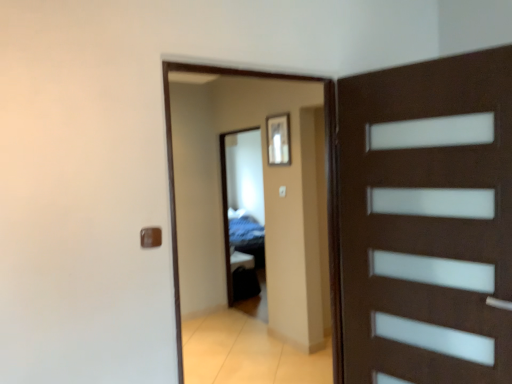
Question: From a real-world perspective, is transparent glass door at center located higher than brown matte door handle at lower left?

Choices:
 (A) no
 (B) yes

Answer: (A)

Question: Can you confirm if transparent glass door at center is wider than brown matte door handle at lower left?

Choices:
 (A) yes
 (B) no

Answer: (A)

Question: From the image's perspective, does transparent glass door at center appear higher than brown matte door handle at lower left?

Choices:
 (A) yes
 (B) no

Answer: (B)

Question: Considering the relative sizes of transparent glass door at center and brown matte door handle at lower left in the image provided, is transparent glass door at center smaller than brown matte door handle at lower left?

Choices:
 (A) yes
 (B) no

Answer: (B)

Question: From a real-world perspective, is transparent glass door at center positioned under brown matte door handle at lower left based on gravity?

Choices:
 (A) yes
 (B) no

Answer: (A)

Question: Is the depth of transparent glass door at center less than that of brown matte door handle at lower left?

Choices:
 (A) no
 (B) yes

Answer: (A)

Question: Does brown matte door handle at lower left have a greater width compared to transparent glass mirror at center?

Choices:
 (A) no
 (B) yes

Answer: (A)

Question: Is brown matte door handle at lower left at the right side of transparent glass mirror at center?

Choices:
 (A) yes
 (B) no

Answer: (B)

Question: Is brown matte door handle at lower left facing away from transparent glass mirror at center?

Choices:
 (A) no
 (B) yes

Answer: (A)

Question: Is transparent glass mirror at center a part of brown matte door handle at lower left?

Choices:
 (A) no
 (B) yes

Answer: (A)

Question: Considering the relative sizes of brown matte door handle at lower left and transparent glass mirror at center in the image provided, is brown matte door handle at lower left smaller than transparent glass mirror at center?

Choices:
 (A) no
 (B) yes

Answer: (B)

Question: Is brown matte door handle at lower left shorter than transparent glass mirror at center?

Choices:
 (A) no
 (B) yes

Answer: (B)

Question: Does transparent glass mirror at center come behind transparent glass door at center?

Choices:
 (A) no
 (B) yes

Answer: (B)